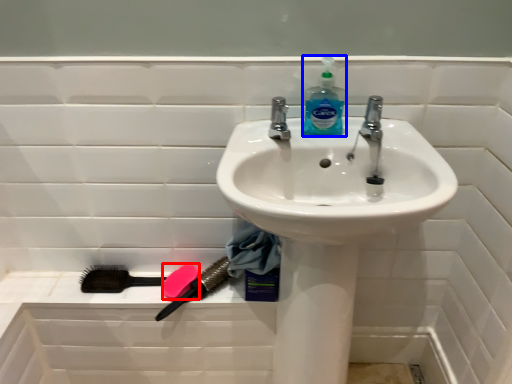
Question: Among these objects, which one is nearest to the camera, soap (highlighted by a red box) or cleaning product (highlighted by a blue box)?

Choices:
 (A) soap
 (B) cleaning product

Answer: (B)